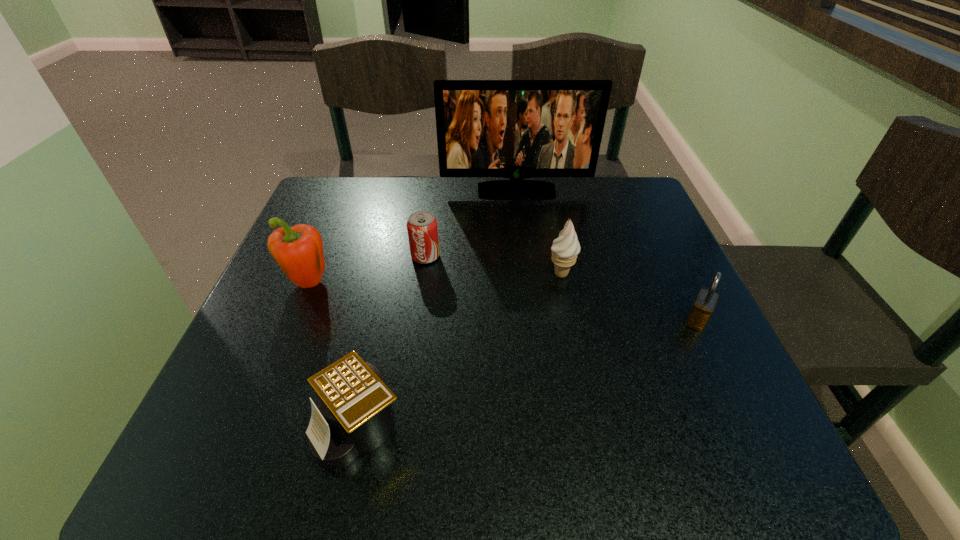
Where is `the farthest object`? the farthest object is located at coordinates (517, 129).

Identify the location of the tallest object. (517, 129).

The image size is (960, 540). I want to click on pepper, so click(x=298, y=250).

At what (x,y) coordinates should I click in order to perform the action: click on icecream. Please return your answer as a coordinate pair (x, y). The image size is (960, 540). Looking at the image, I should click on (566, 247).

Locate an element on the screen. The width and height of the screenshot is (960, 540). the second nearest object is located at coordinates (704, 305).

Where is `padlock`? padlock is located at coordinates (704, 305).

Find the location of a particular element. The width and height of the screenshot is (960, 540). soda can is located at coordinates (422, 229).

I want to click on calculator, so click(x=353, y=416).

Image resolution: width=960 pixels, height=540 pixels. I want to click on vacant space located on the front-facing side of the farthest object, so click(525, 272).

At what (x,y) coordinates should I click in order to perform the action: click on free spot located on the front of the pepper. Please return your answer as a coordinate pair (x, y). Looking at the image, I should click on (233, 465).